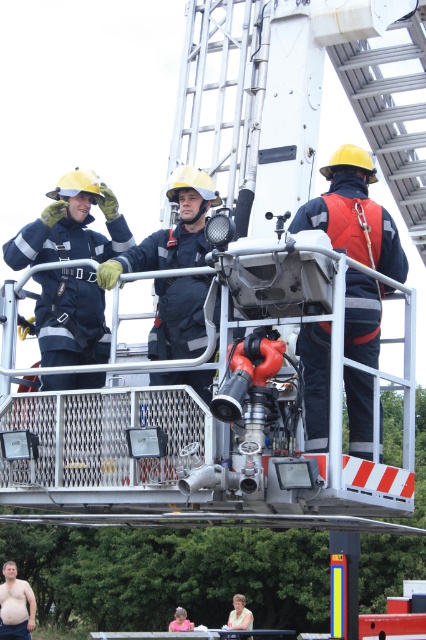
Question: Can you confirm if orange reflective vest at center is smaller than yellow hard hat at upper center?

Choices:
 (A) yes
 (B) no

Answer: (B)

Question: Among these points, which one is farthest from the camera?

Choices:
 (A) (236, 625)
 (B) (347, 296)
 (C) (28, 627)
 (D) (181, 627)

Answer: (D)

Question: Is skinny man at lower left to the right of yellow hard hat at upper center from the viewer's perspective?

Choices:
 (A) yes
 (B) no

Answer: (B)

Question: Does yellow hard hat at upper center appear on the left side of pink fabric shirt at lower center?

Choices:
 (A) no
 (B) yes

Answer: (A)

Question: Which object appears farthest from the camera in this image?

Choices:
 (A) orange reflective vest at center
 (B) skinny man at lower left
 (C) yellow hard hat at upper center

Answer: (B)

Question: Which object appears farthest from the camera in this image?

Choices:
 (A) skinny man at lower left
 (B) pink fabric shirt at lower center
 (C) yellow hard hat at upper center

Answer: (B)